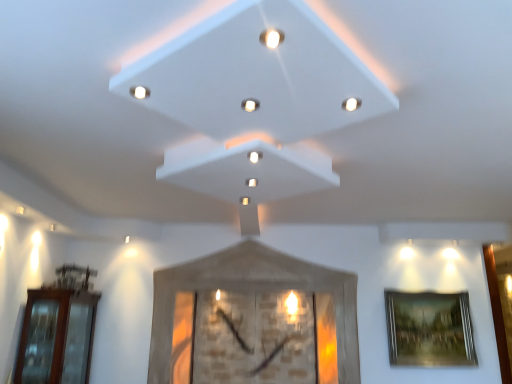
Question: Which direction should I rotate to look at white glossy light at center, acting as the 3th light starting from the top?

Choices:
 (A) right
 (B) left

Answer: (B)

Question: Can you confirm if brown glass door at left is bigger than white glossy light at upper center, the first light in the front-to-back sequence?

Choices:
 (A) yes
 (B) no

Answer: (A)

Question: From the image's perspective, is brown glass door at left above white glossy light at upper center, which is the fourth light from bottom to top?

Choices:
 (A) no
 (B) yes

Answer: (A)

Question: Can you confirm if brown glass door at left is positioned to the left of white glossy light at upper center, the fourth light positioned from the back?

Choices:
 (A) no
 (B) yes

Answer: (B)

Question: Considering the relative sizes of brown glass door at left and white glossy light at upper center, which ranks as the 1th light in left-to-right order, in the image provided, is brown glass door at left smaller than white glossy light at upper center, which ranks as the 1th light in left-to-right order,?

Choices:
 (A) no
 (B) yes

Answer: (A)

Question: Can we say brown glass door at left lies outside white glossy light at upper center, the fourth light when ordered from right to left?

Choices:
 (A) yes
 (B) no

Answer: (A)

Question: From the image's perspective, is brown glass door at left below white glossy light at upper center, the fourth light positioned from the back?

Choices:
 (A) no
 (B) yes

Answer: (B)

Question: From the image's perspective, is white matte exhaust hood at center over white glossy light at center, which appears as the 2th light when ordered from the bottom?

Choices:
 (A) no
 (B) yes

Answer: (A)

Question: Does white matte exhaust hood at center have a lesser height compared to white glossy light at center, the 3th light viewed from the left?

Choices:
 (A) yes
 (B) no

Answer: (B)

Question: Is white matte exhaust hood at center positioned with its back to white glossy light at center, acting as the 2th light starting from the right?

Choices:
 (A) yes
 (B) no

Answer: (B)

Question: From a real-world perspective, is white matte exhaust hood at center under white glossy light at center, which appears as the 2th light when ordered from the bottom?

Choices:
 (A) yes
 (B) no

Answer: (B)

Question: Is white matte exhaust hood at center smaller than white glossy light at center, acting as the 3th light starting from the top?

Choices:
 (A) no
 (B) yes

Answer: (A)

Question: Is white matte exhaust hood at center touching white glossy light at center, the 3th light viewed from the front?

Choices:
 (A) yes
 (B) no

Answer: (B)

Question: Does white glossy light at center, the fourth light when ordered from front to back, come behind matte white light at upper right, acting as the 2th light starting from the front?

Choices:
 (A) yes
 (B) no

Answer: (A)